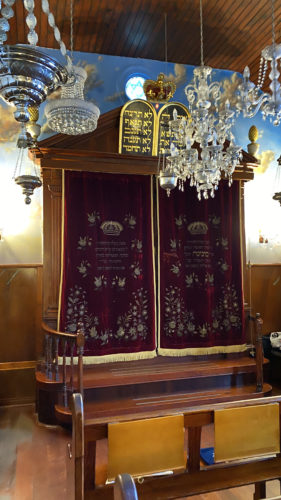
Locate an element on the screen. tapistry is located at coordinates (120, 218), (206, 312).